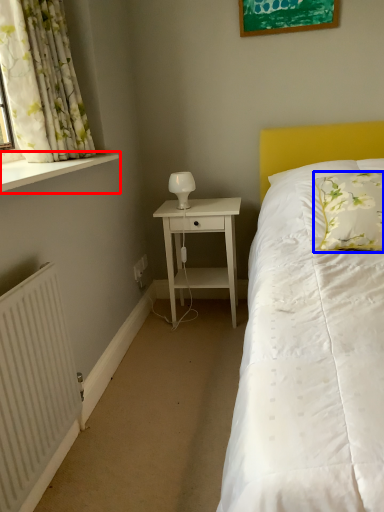
Question: Which of the following is the closest to the observer, window sill (highlighted by a red box) or pillow (highlighted by a blue box)?

Choices:
 (A) window sill
 (B) pillow

Answer: (A)